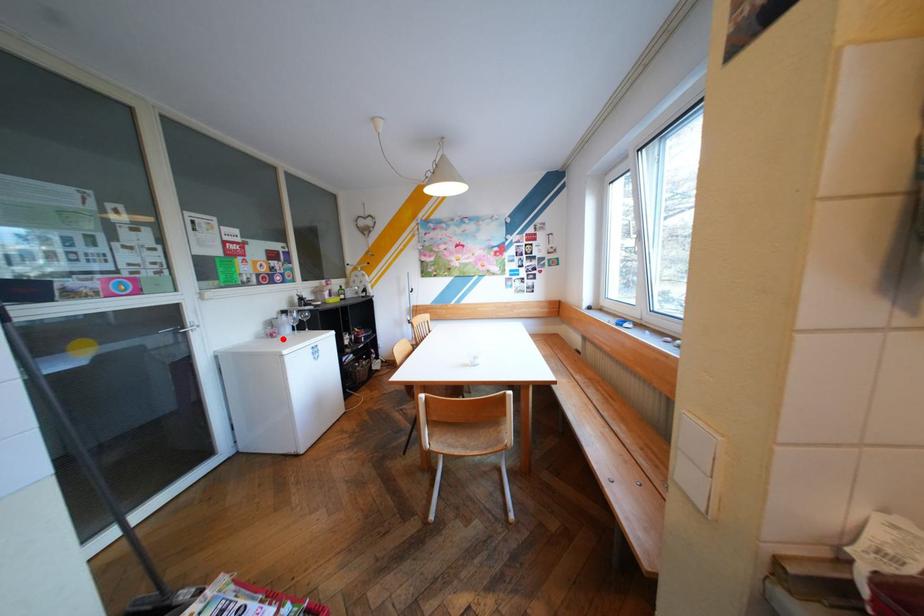
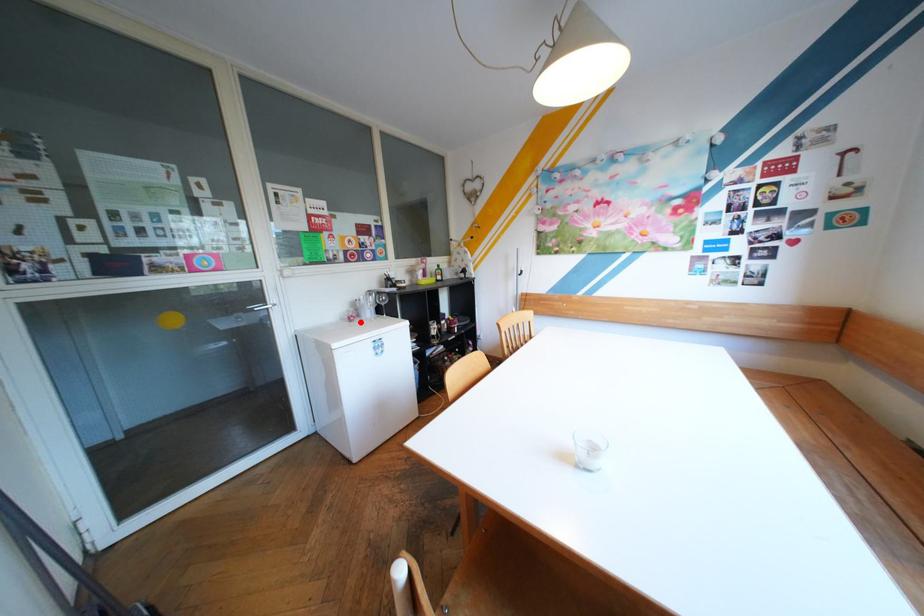
I am providing you with two images of the same scene from different viewpoints. A red point is marked on the first image and another point is marked on the second image. Do the highlighted points in image1 and image2 indicate the same real-world spot?

Yes